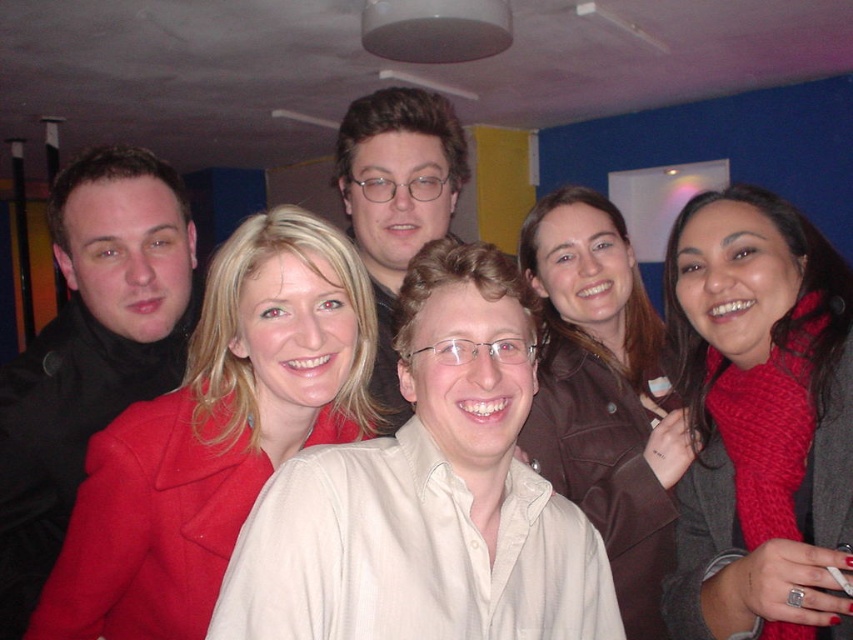
Is point (286, 577) positioned behind point (38, 528)?

No, it is not.

Where is `white matte shirt at center`? This screenshot has width=853, height=640. white matte shirt at center is located at coordinates (428, 496).

Who is more forward, (473,637) or (106,403)?

Point (473,637)

Image resolution: width=853 pixels, height=640 pixels. In order to click on white matte shirt at center in this screenshot , I will do `click(428, 496)`.

Between knitted red scarf at right and brown leather jacket at upper center, which one appears on the left side from the viewer's perspective?

From the viewer's perspective, brown leather jacket at upper center appears more on the left side.

Which is behind, point (700, 284) or point (657, 436)?

Positioned behind is point (657, 436).

Find the location of a particular element. The height and width of the screenshot is (640, 853). knitted red scarf at right is located at coordinates (759, 420).

Consider the image. Between matte red coat at left and matte black jacket at left, which one appears on the left side from the viewer's perspective?

matte black jacket at left

Between point (151, 500) and point (158, 216), which one is positioned in front?

Point (151, 500) is in front.

Is point (83, 493) closer to camera compared to point (30, 611)?

Yes, it is in front of point (30, 611).

Locate an element on the screen. The width and height of the screenshot is (853, 640). matte red coat at left is located at coordinates (216, 433).